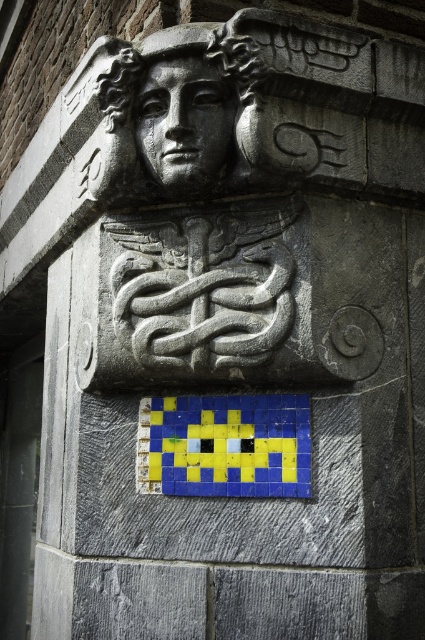
You are an art conservator examining the stone architectural detail. You notice the pixelated yellow tile at center and the gray stone face at center. Which object is closer to you?

The pixelated yellow tile at center is closer to you because the gray stone face at center is behind it.

In the scene shown: You are an architect designing a new building and want to incorporate both the pixelated yellow tile at center and the gray stone face at center into a symmetrical pattern. Considering their widths, which object should you place in the center to maintain symmetry?

The pixelated yellow tile at center might be wider than gray stone face at center, so placing the pixelated yellow tile at center in the center would help maintain symmetry due to its potentially larger width.